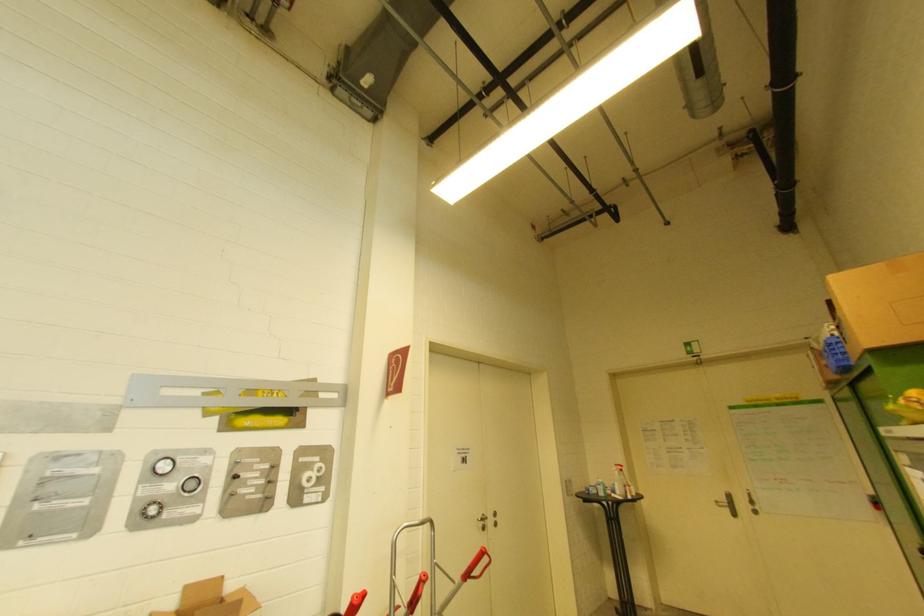
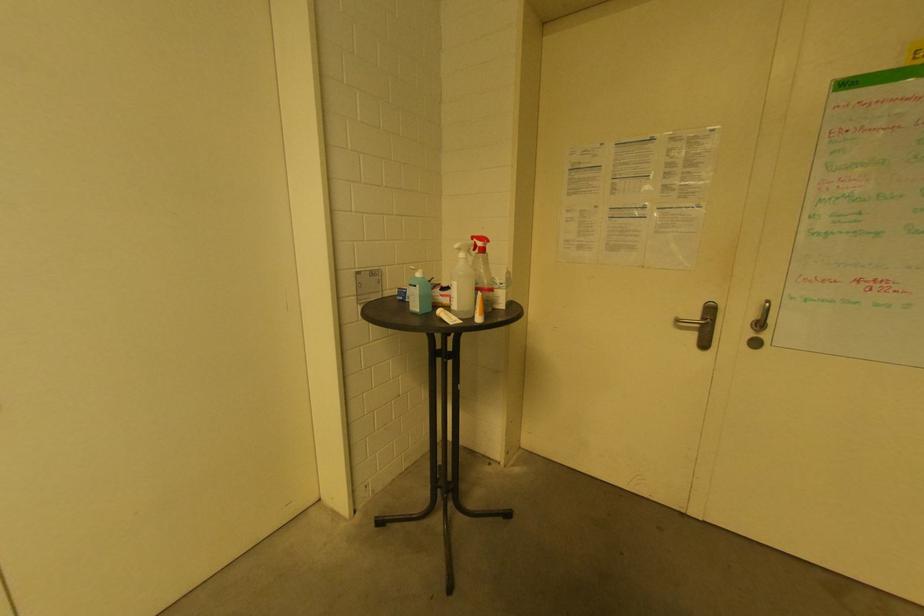
Locate, in the second image, the point that corresponds to pixel 618 474 in the first image.

(464, 256)